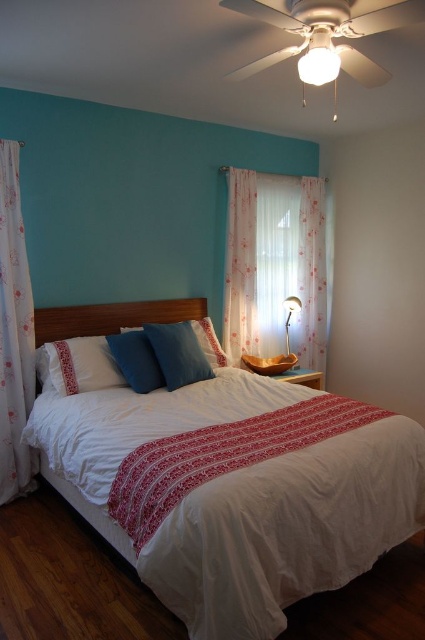
Can you confirm if white textured blanket at center is positioned above floral sheer curtain at left?

Actually, white textured blanket at center is below floral sheer curtain at left.

Can you confirm if white textured blanket at center is wider than floral sheer curtain at left?

Correct, the width of white textured blanket at center exceeds that of floral sheer curtain at left.

Is point (215, 464) closer to viewer compared to point (11, 385)?

Yes.

Locate an element on the screen. The height and width of the screenshot is (640, 425). white textured blanket at center is located at coordinates (221, 456).

The width and height of the screenshot is (425, 640). In order to click on floral sheer curtain at left in this screenshot , I will do `click(14, 332)`.

Who is positioned more to the right, floral sheer curtain at left or metallic gold lamp at right?

metallic gold lamp at right

Locate an element on the screen. This screenshot has width=425, height=640. floral sheer curtain at left is located at coordinates (14, 332).

The height and width of the screenshot is (640, 425). I want to click on floral sheer curtain at left, so click(x=14, y=332).

Where is `white sheer curtain at center`? white sheer curtain at center is located at coordinates (240, 266).

Can you confirm if white sheer curtain at center is positioned to the right of blue matte pillow at center?

Indeed, white sheer curtain at center is positioned on the right side of blue matte pillow at center.

Is point (237, 220) closer to viewer compared to point (158, 364)?

No, (237, 220) is further to viewer.

Where is `white sheer curtain at center`? white sheer curtain at center is located at coordinates (240, 266).